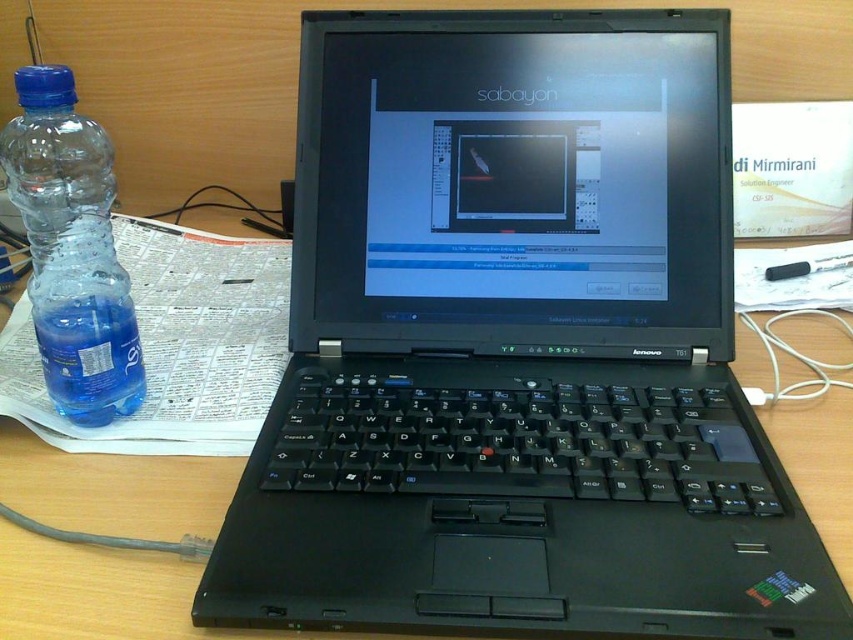
Between transparent plastic bottle at left and transparent plastic water at bottle left, which one appears on the right side from the viewer's perspective?

Positioned to the right is transparent plastic water at bottle left.

Who is taller, transparent plastic bottle at left or transparent plastic water at bottle left?

Standing taller between the two is transparent plastic bottle at left.

Where is `transparent plastic bottle at left`? transparent plastic bottle at left is located at coordinates (73, 250).